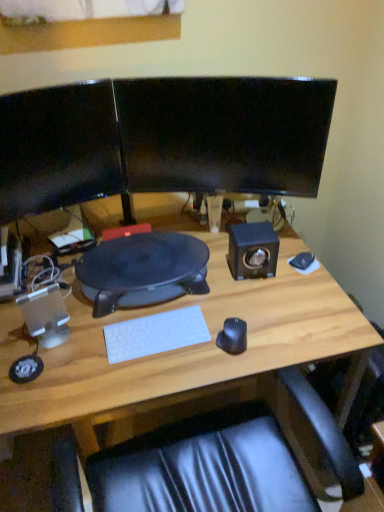
Find the location of a particular element. Image resolution: width=384 pixels, height=512 pixels. blank space above wooden desk at center (from a real-world perspective) is located at coordinates (169, 304).